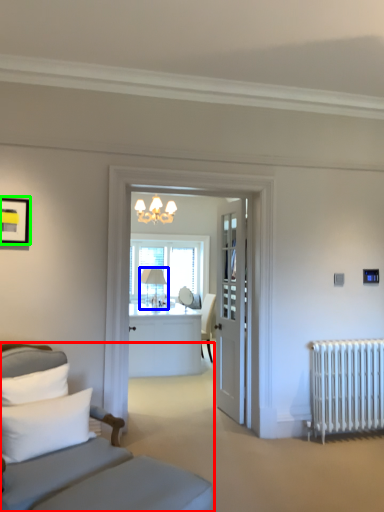
Question: Which is farther away from studio couch (highlighted by a red box)? table lamp (highlighted by a blue box) or picture frame (highlighted by a green box)?

Choices:
 (A) table lamp
 (B) picture frame

Answer: (A)